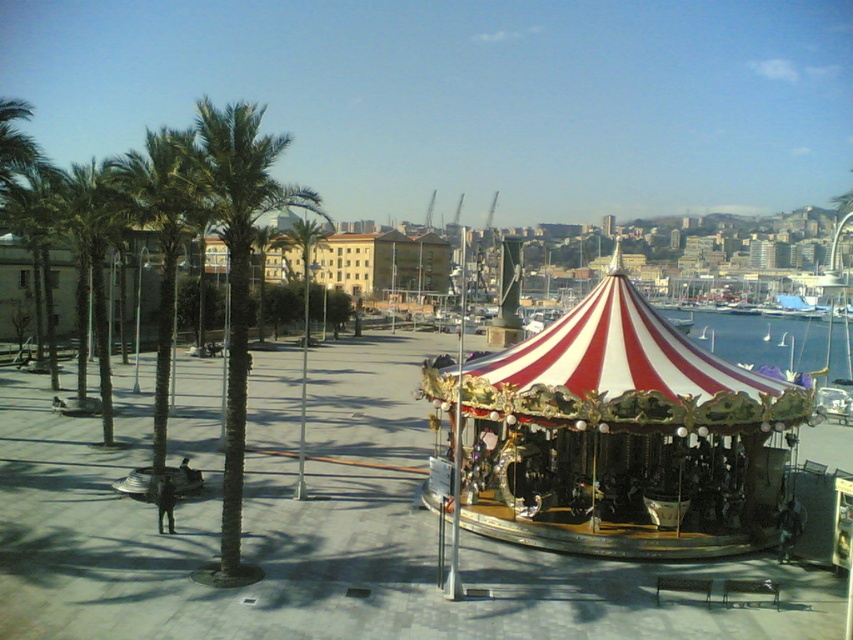
You are standing at the entrance of the square and want to locate the red and white striped carousel at center. According to the coordinates provided, where should you look relative to your current position?

The red and white striped carousel at center is located at coordinates point (x=611, y=436), which means it is positioned to the upper right of your current position at the entrance.

Looking at this image, you are a city planner assessing the space between the red and white striped carousel at center and the green leafy palm tree at left. Based on their heights, which one would require more vertical clearance for a new overhead walkway?

The green leafy palm tree at left requires more vertical clearance because it is taller than the red and white striped carousel at center.